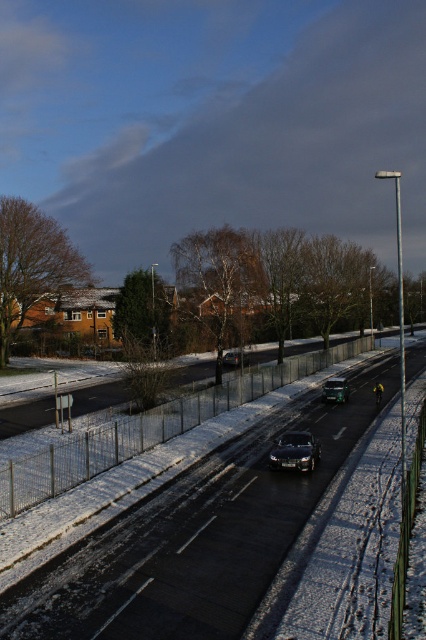
You are a delivery driver who needs to park your shiny black car at center on the black asphalt road at center. Is there enough space to park your car without crossing the road edges?

The black asphalt road at center might be wider than shiny black car at center, so there is likely enough space to park the car without crossing the road edges.

You are a delivery driver who needs to park your shiny black car at center on the black asphalt road at center. Can you park your car here without any issues?

The black asphalt road at center is larger in size than the shiny black car at center, so there should be enough space to park the car without any issues.